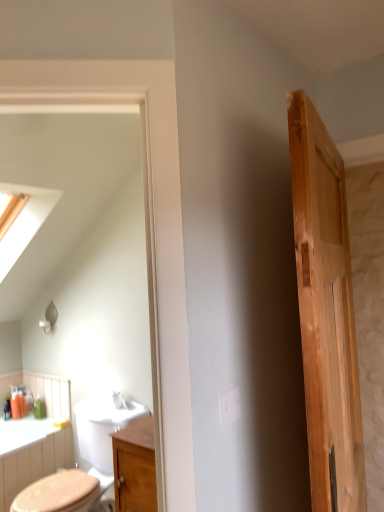
Question: Considering their positions, is wooden cabinet at center located in front of or behind natural wood door at right?

Choices:
 (A) front
 (B) behind

Answer: (B)

Question: From a real-world perspective, is wooden cabinet at center above or below natural wood door at right?

Choices:
 (A) below
 (B) above

Answer: (A)

Question: From the image's perspective, is wooden cabinet at center located above or below natural wood door at right?

Choices:
 (A) above
 (B) below

Answer: (B)

Question: From the image's perspective, is natural wood door at right located above or below wooden cabinet at center?

Choices:
 (A) below
 (B) above

Answer: (B)

Question: Is natural wood door at right in front of or behind wooden cabinet at center in the image?

Choices:
 (A) front
 (B) behind

Answer: (A)

Question: From a real-world perspective, is natural wood door at right physically located above or below wooden cabinet at center?

Choices:
 (A) above
 (B) below

Answer: (A)

Question: Looking at their shapes, would you say natural wood door at right is wider or thinner than wooden cabinet at center?

Choices:
 (A) thin
 (B) wide

Answer: (A)